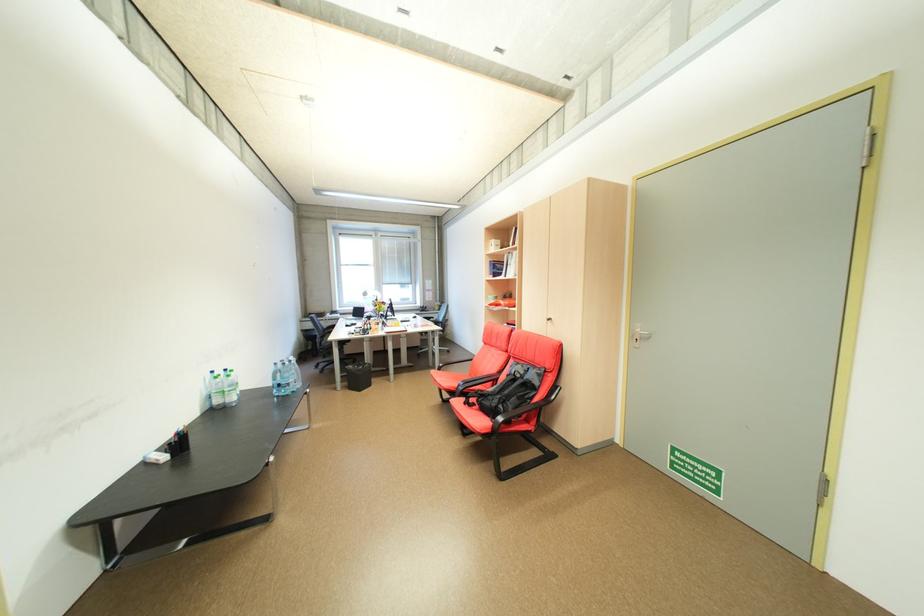
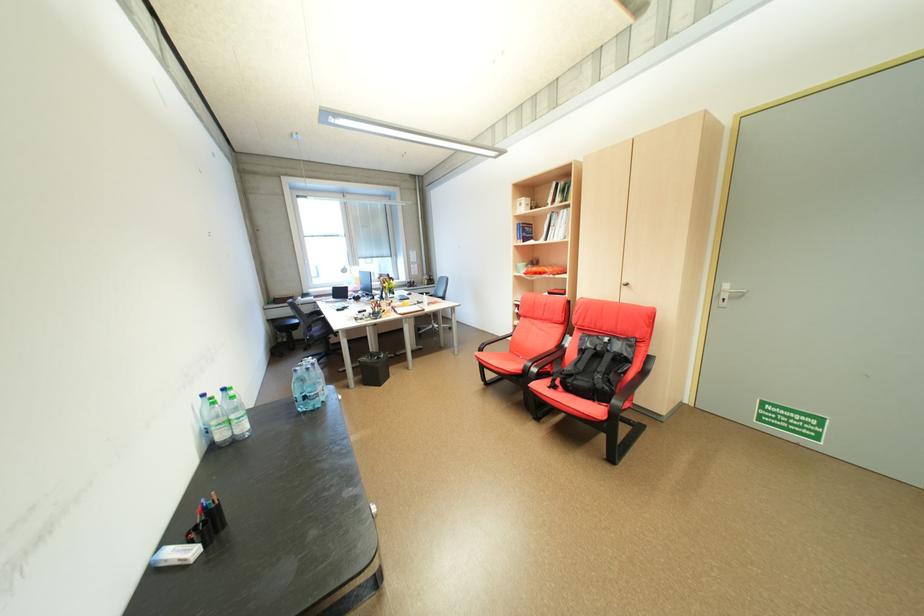
Locate, in the second image, the point that corresponds to point (232, 374) in the first image.

(228, 395)